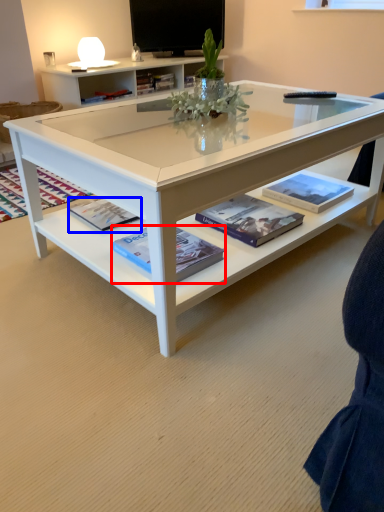
Question: Which point is closer to the camera, book (highlighted by a red box) or paperback book (highlighted by a blue box)?

Choices:
 (A) book
 (B) paperback book

Answer: (A)